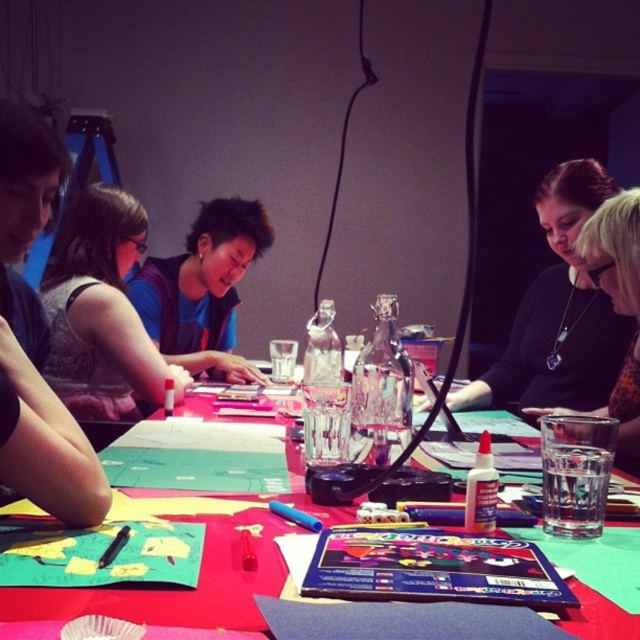
Question: Estimate the real-world distances between objects in this image. Which object is farther from the black matte shirt at upper center?

Choices:
 (A) black necklace at upper right
 (B) matte black marker at center
 (C) red paper table at center
 (D) matte blue shirt at center

Answer: (D)

Question: From the image, what is the correct spatial relationship of red paper table at center in relation to matte blue shirt at center?

Choices:
 (A) above
 (B) below

Answer: (B)

Question: Which object appears closest to the camera in this image?

Choices:
 (A) matte black marker at center
 (B) red paper table at center
 (C) black necklace at upper right
 (D) matte blue shirt at center

Answer: (B)

Question: Is matte black marker at center to the left of red paper table at center from the viewer's perspective?

Choices:
 (A) no
 (B) yes

Answer: (B)

Question: Which object is closer to the camera taking this photo?

Choices:
 (A) black matte shirt at upper center
 (B) matte blue shirt at center
 (C) black necklace at upper right

Answer: (C)

Question: Can you confirm if matte black marker at center is positioned below black necklace at upper right?

Choices:
 (A) yes
 (B) no

Answer: (B)